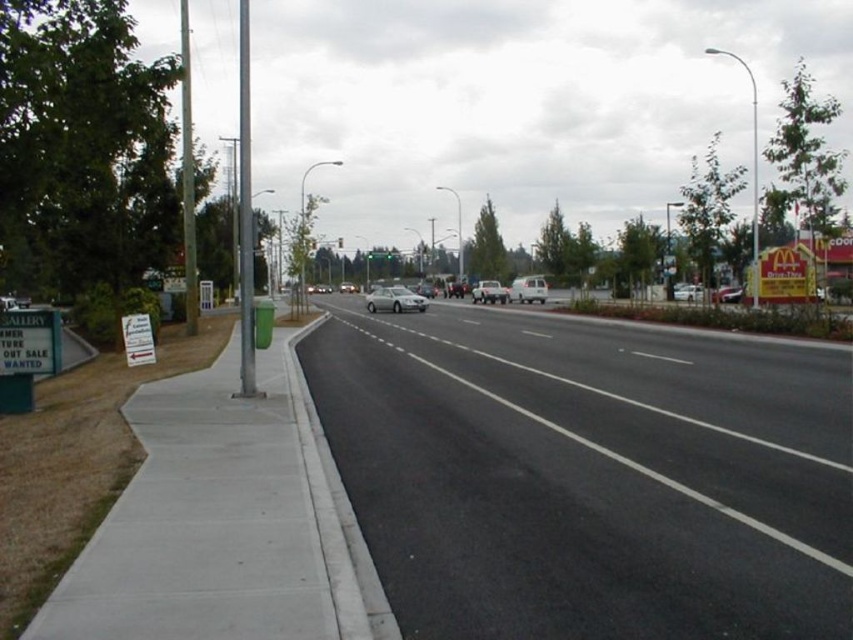
You are a pedestrian standing at the sidewalk on the left side of the road. You see two points marked in the image. The first point is at coordinate point (648, 531) and the second point is at coordinate point (12, 355). Which point is closer to you?

Point (648, 531) is closer to the viewer than point (12, 355).

You are a pedestrian standing at the sidewalk on the left side of the road. You want to cross to the McDonalds restaurant on the right side. The road has a black asphalt highway at center. Given that the distance from you to the highway is 4.44 meters, and you need to cross the highway to reach McDonalds, is this distance sufficient for you to safely cross before any oncoming traffic arrives?

The black asphalt highway at center is 4.44 meters away from the camera. Since this distance is the distance from your current position to the highway, you would need to cross this 4.44 meters. However, without knowing the speed or proximity of oncoming traffic, it is impossible to determine if this distance is sufficient for safe crossing. Always check for traffic before crossing.